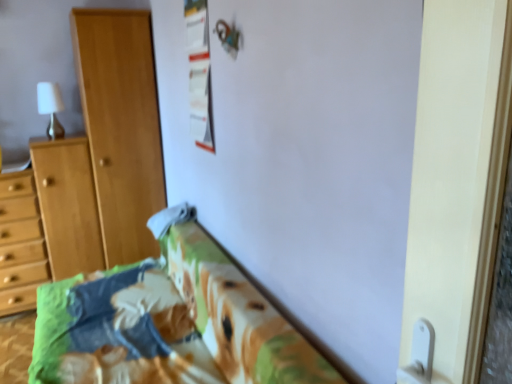
Question: Could you tell me if white matte lamp at upper left is turned towards light brown wooden cupboard at left?

Choices:
 (A) yes
 (B) no

Answer: (B)

Question: Does white matte lamp at upper left have a larger size compared to light brown wooden cupboard at left?

Choices:
 (A) no
 (B) yes

Answer: (A)

Question: Is white matte lamp at upper left positioned in front of light brown wooden cupboard at left?

Choices:
 (A) yes
 (B) no

Answer: (B)

Question: Does white matte lamp at upper left have a greater height compared to light brown wooden cupboard at left?

Choices:
 (A) yes
 (B) no

Answer: (B)

Question: Is light brown wooden cupboard at left located within white matte lamp at upper left?

Choices:
 (A) yes
 (B) no

Answer: (B)

Question: From the image's perspective, relative to white fabric pillow at lower center, is white glossy screen door at right above or below?

Choices:
 (A) below
 (B) above

Answer: (B)

Question: From their relative heights in the image, would you say white glossy screen door at right is taller or shorter than white fabric pillow at lower center?

Choices:
 (A) tall
 (B) short

Answer: (A)

Question: Considering the relative positions of white glossy screen door at right and white fabric pillow at lower center in the image provided, is white glossy screen door at right to the left or to the right of white fabric pillow at lower center?

Choices:
 (A) left
 (B) right

Answer: (B)

Question: From a real-world perspective, relative to white fabric pillow at lower center, is white glossy screen door at right vertically above or below?

Choices:
 (A) above
 (B) below

Answer: (A)

Question: Considering the positions of point (407, 246) and point (131, 51), is point (407, 246) closer or farther from the camera than point (131, 51)?

Choices:
 (A) farther
 (B) closer

Answer: (B)

Question: Considering the positions of white glossy screen door at right and light brown wooden cupboard at left in the image, is white glossy screen door at right bigger or smaller than light brown wooden cupboard at left?

Choices:
 (A) small
 (B) big

Answer: (A)

Question: Looking at their shapes, would you say white glossy screen door at right is wider or thinner than light brown wooden cupboard at left?

Choices:
 (A) wide
 (B) thin

Answer: (B)

Question: From the image's perspective, is white glossy screen door at right above or below light brown wooden cupboard at left?

Choices:
 (A) above
 (B) below

Answer: (B)

Question: Is white glossy screen door at right inside or outside of light wood dresser at left?

Choices:
 (A) outside
 (B) inside

Answer: (A)

Question: Considering the positions of white glossy screen door at right and light wood dresser at left in the image, is white glossy screen door at right wider or thinner than light wood dresser at left?

Choices:
 (A) thin
 (B) wide

Answer: (A)